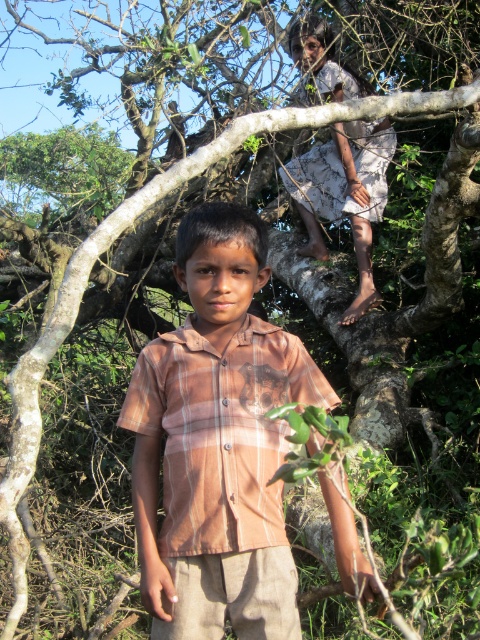
Question: Is brown plaid shirt at center to the left of white cotton dress at upper center from the viewer's perspective?

Choices:
 (A) yes
 (B) no

Answer: (A)

Question: Which point is closer to the camera taking this photo?

Choices:
 (A) (237, 611)
 (B) (351, 172)

Answer: (A)

Question: Is the position of brown plaid shirt at center more distant than that of white cotton dress at upper center?

Choices:
 (A) yes
 (B) no

Answer: (B)

Question: Does brown plaid shirt at center have a smaller size compared to white cotton dress at upper center?

Choices:
 (A) yes
 (B) no

Answer: (A)